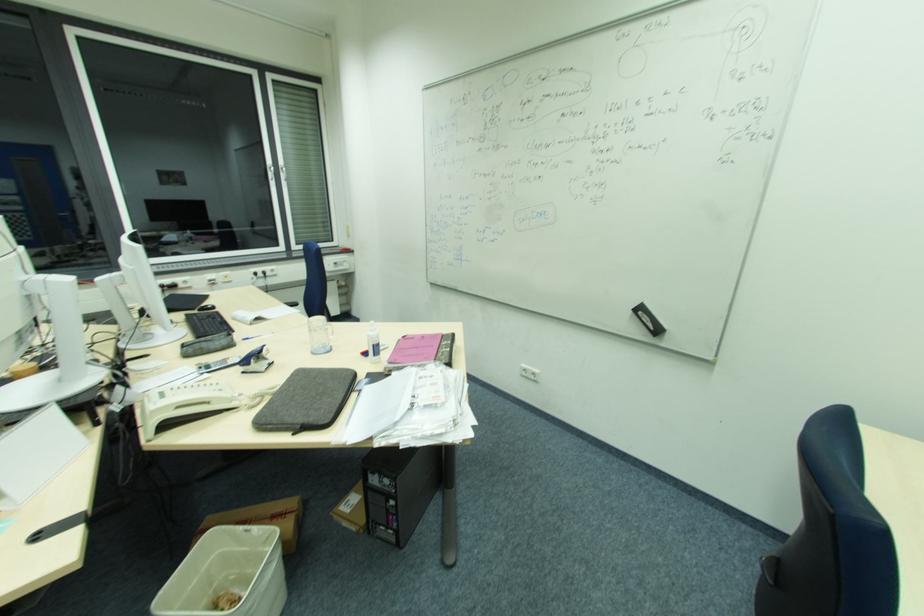
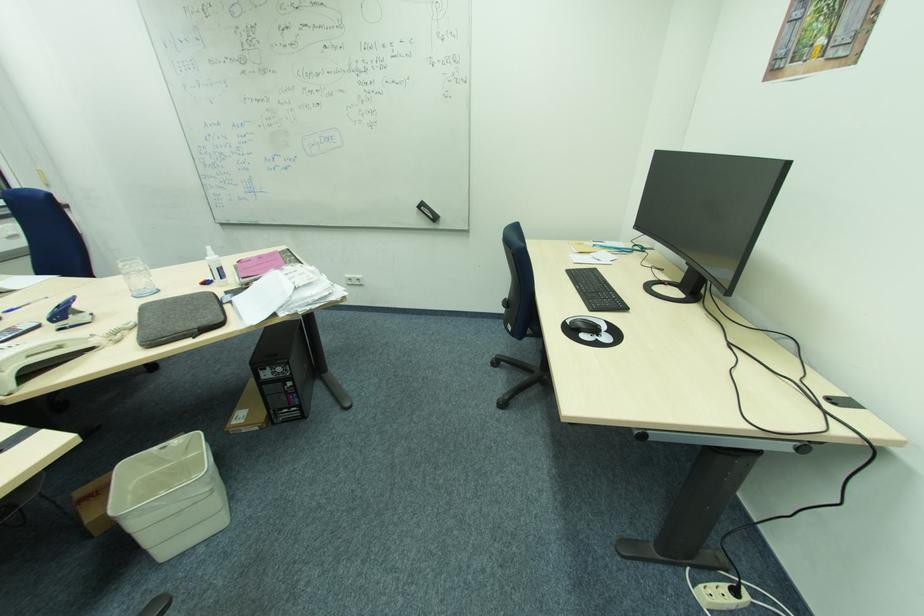
Where in the second image is the point corresponding to point 643,314 from the first image?

(426, 208)